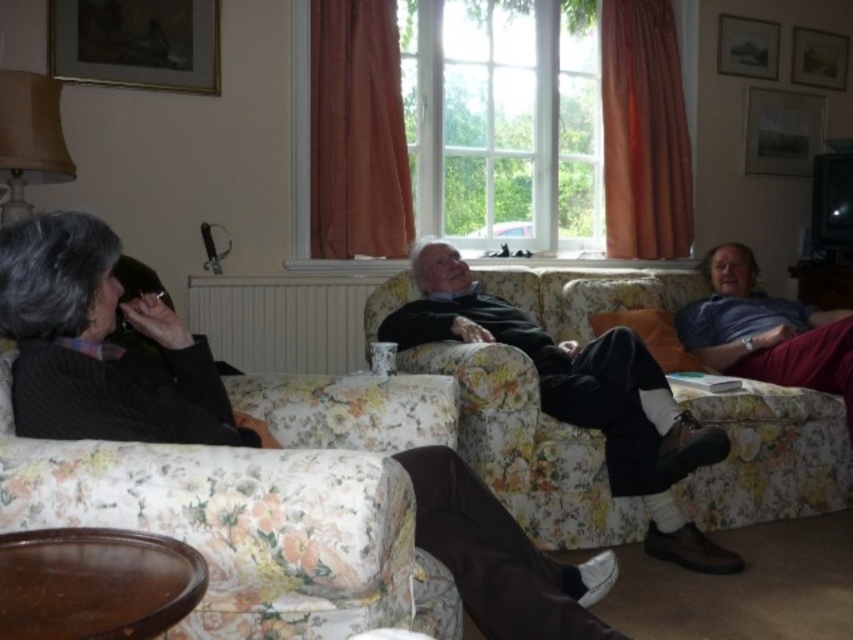
Question: Is black sweater at center bigger than dark green sweater at center?

Choices:
 (A) no
 (B) yes

Answer: (A)

Question: Which point is closer to the camera taking this photo?

Choices:
 (A) (44, 412)
 (B) (602, 356)

Answer: (A)

Question: Does black sweater at center appear on the left side of dark green sweater at center?

Choices:
 (A) no
 (B) yes

Answer: (B)

Question: Is black sweater at center thinner than dark green sweater at center?

Choices:
 (A) no
 (B) yes

Answer: (B)